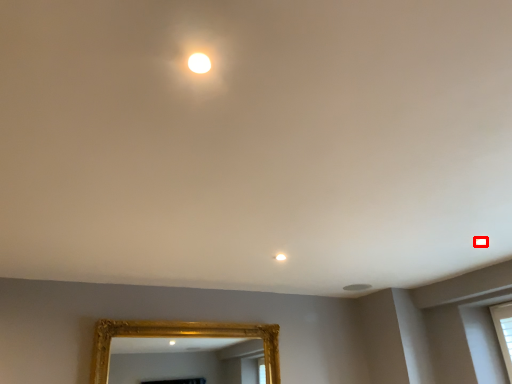
Question: From the image's perspective, what is the correct spatial positioning of light (annotated by the red box) in reference to mirror?

Choices:
 (A) below
 (B) above

Answer: (B)